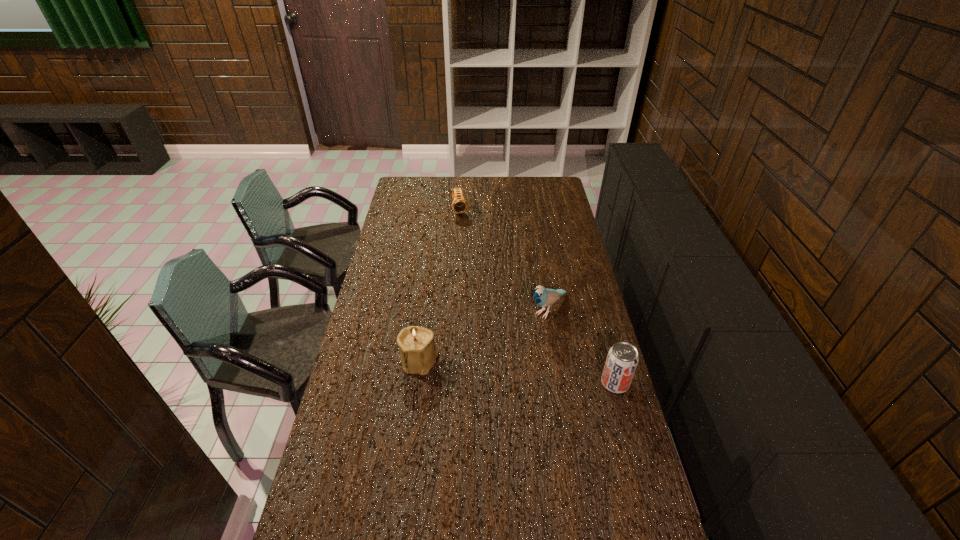
Locate an element on the screen. The image size is (960, 540). vacant area that lies between the bird and the candle_holder is located at coordinates (484, 335).

Image resolution: width=960 pixels, height=540 pixels. What are the coordinates of `object identified as the second closest to the second object from right to left` in the screenshot? It's located at (418, 353).

This screenshot has width=960, height=540. I want to click on object that is the second nearest to the rightmost object, so click(418, 353).

Locate an element on the screen. This screenshot has width=960, height=540. free space that satisfies the following two spatial constraints: 1. on the front side of the shortest object; 2. on the right side of the soda can is located at coordinates (450, 383).

Identify the location of blank area in the image that satisfies the following two spatial constraints: 1. on the back side of the third object from left to right; 2. on the right side of the leftmost object. [426, 309].

This screenshot has width=960, height=540. Find the location of `vacant space that satisfies the following two spatial constraints: 1. on the front side of the shortest object; 2. on the right side of the second object from right to left`. vacant space that satisfies the following two spatial constraints: 1. on the front side of the shortest object; 2. on the right side of the second object from right to left is located at coordinates (454, 309).

You are a GUI agent. You are given a task and a screenshot of the screen. Output one action in this format:
    pyautogui.click(x=<x>, y=<y>)
    Task: Click on the free location that satisfies the following two spatial constraints: 1. on the front side of the rightmost object; 2. on the right side of the bird
    
    Given the screenshot: What is the action you would take?
    pyautogui.click(x=561, y=383)

You are a GUI agent. You are given a task and a screenshot of the screen. Output one action in this format:
    pyautogui.click(x=<x>, y=<y>)
    Task: Click on the free space that satisfies the following two spatial constraints: 1. on the front side of the candle_holder; 2. on the left side of the soda can
    
    Given the screenshot: What is the action you would take?
    pyautogui.click(x=417, y=383)

In order to click on vacant space that satisfies the following two spatial constraints: 1. on the front side of the second farthest object; 2. on the left side of the rightmost object in this screenshot , I will do `click(561, 383)`.